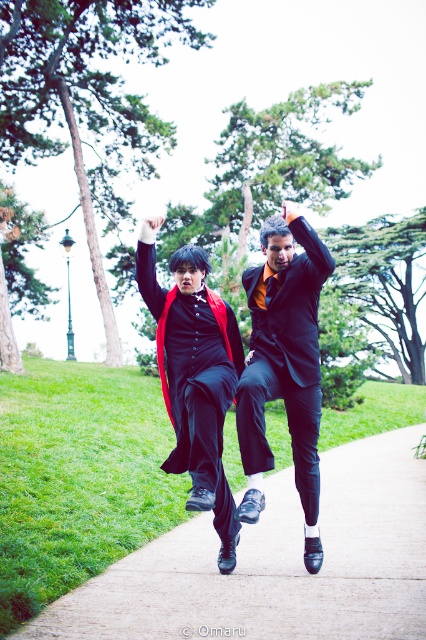
Is point (294, 296) less distant than point (233, 326)?

Yes.

Can you confirm if shiny black suit at center is smaller than velvet red cape at center?

No.

Is point (305, 305) farther from viewer compared to point (203, 296)?

No, (305, 305) is in front of (203, 296).

Identify the location of shiny black suit at center. This screenshot has width=426, height=640. (284, 365).

Which is above, paved concrete at center or shiny black suit at center?

shiny black suit at center is above.

Is point (221, 604) more distant than point (256, 282)?

No, (221, 604) is in front of (256, 282).

Where is `paved concrete at center`? paved concrete at center is located at coordinates (276, 564).

Is paved concrete at center to the right of velvet red cape at center from the viewer's perspective?

Correct, you'll find paved concrete at center to the right of velvet red cape at center.

Who is more forward, (x=377, y=486) or (x=178, y=410)?

Point (x=178, y=410) is more forward.

I want to click on paved concrete at center, so click(x=276, y=564).